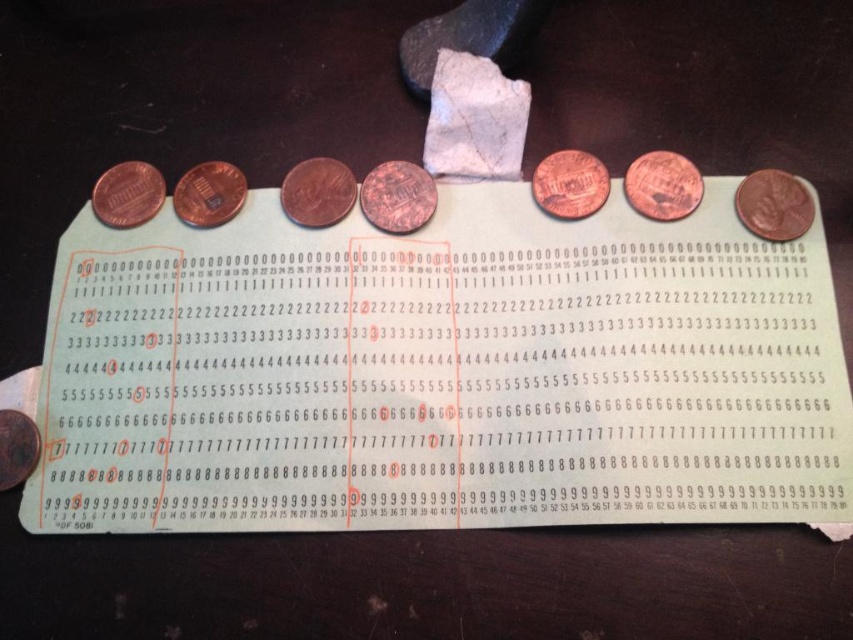
Is copper shiny penny at center smaller than copper/brass penny at left?

Yes, copper shiny penny at center is smaller than copper/brass penny at left.

Is copper shiny penny at center bigger than copper/brass penny at left?

No.

Where is `copper shiny penny at center`? copper shiny penny at center is located at coordinates (317, 193).

Where is `copper shiny penny at center`? copper shiny penny at center is located at coordinates (317, 193).

Does point (363, 209) come in front of point (650, 168)?

No, it is not.

Between copper metallic penny at center and copper/brass penny at upper right, which one is positioned lower?

Positioned lower is copper metallic penny at center.

Between point (421, 186) and point (671, 177), which one is positioned behind?

The point (421, 186) is more distant.

Image resolution: width=853 pixels, height=640 pixels. What are the coordinates of `copper metallic penny at center` in the screenshot? It's located at (397, 196).

Does point (770, 216) come behind point (15, 452)?

Yes, it is behind point (15, 452).

Is brass/bronze penny at right in front of brass/bronze coin at lower left?

No, it is behind brass/bronze coin at lower left.

Is point (781, 232) positioned before point (28, 451)?

No, it is behind (28, 451).

Locate an element on the screen. The height and width of the screenshot is (640, 853). brass/bronze penny at right is located at coordinates (773, 204).